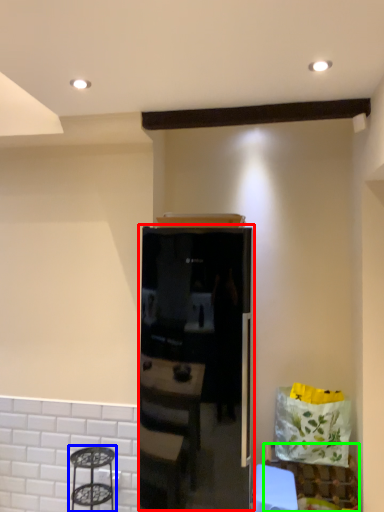
Question: Which object is the closest to the appliance (highlighted by a red box)? Choose among these: step stool (highlighted by a blue box) or furniture (highlighted by a green box).

Choices:
 (A) step stool
 (B) furniture

Answer: (A)